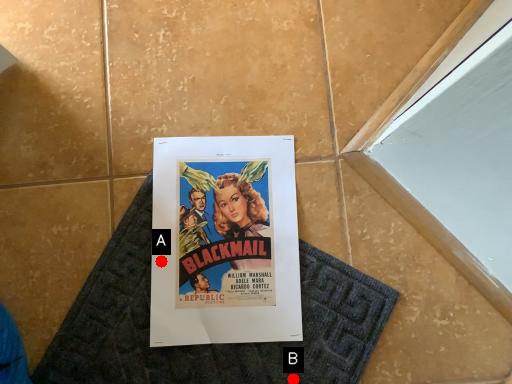
Question: Two points are circled on the image, labeled by A and B beside each circle. Which point is farther from the camera taking this photo?

Choices:
 (A) A is further
 (B) B is further

Answer: (A)